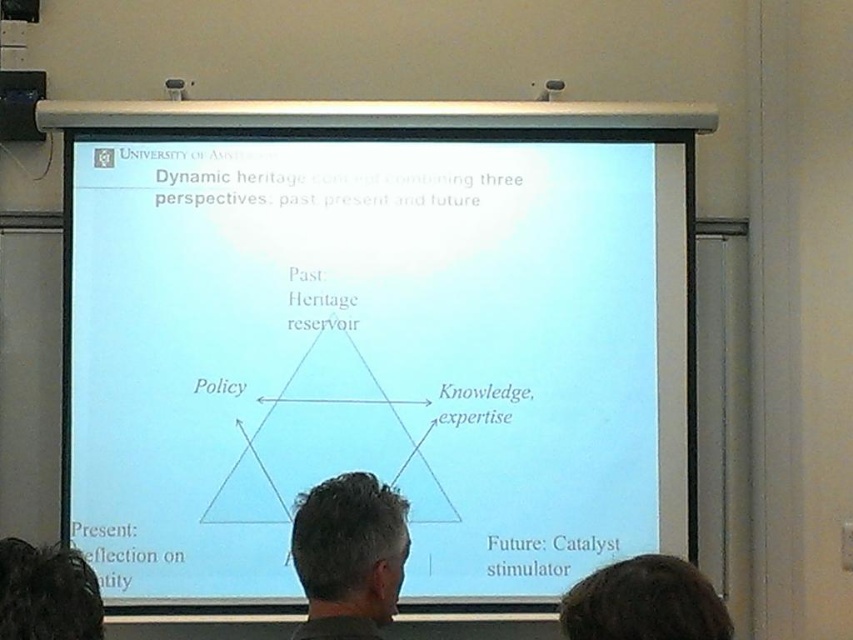
You are a student sitting in the classroom and looking at the presentation. You notice two items at the center of the image. Which one is taller, the white paper at center or the gray hair at center?

The white paper at center is taller than the gray hair at center.

From the picture: You are a photographer standing in the classroom and want to take a clear photo of the white paper at center. Your camera has a minimum focus distance of 2 meters. Can you take the photo without moving closer?

The white paper at center and camera are 3.50 meters apart. Since the minimum focus distance is 2 meters, the photographer can take the photo without moving closer as the distance is sufficient.

In the classroom scene, there are two people with different hair colors. The first has gray hair at center and the second has dark brown hair at upper center. Which person is standing closer to the projection screen displaying the University of Amsterdam slide?

The gray hair at center is much taller as dark brown hair at upper center, so the person with gray hair at center is closer to the projection screen since they appear larger in the image.